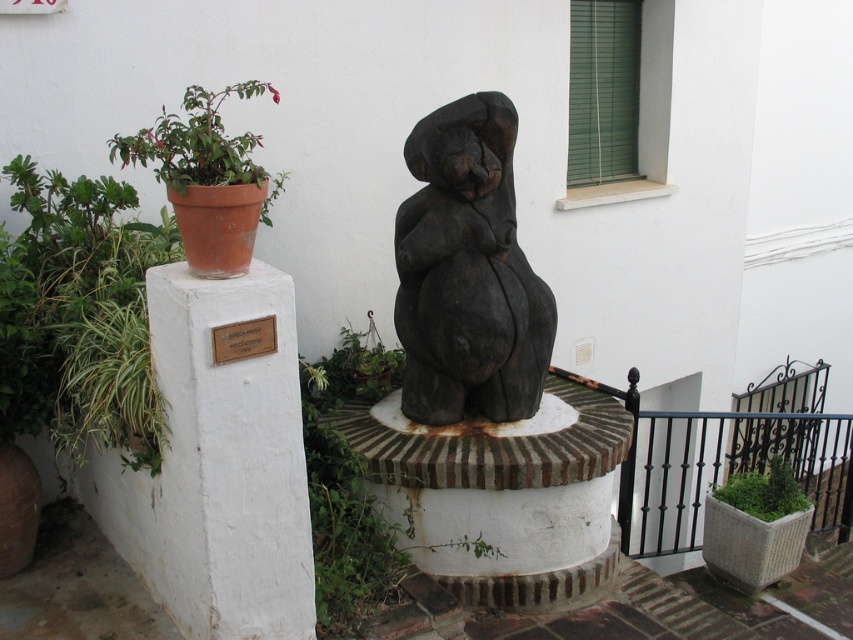
You are a gardener who needs to water the green leafy plant at left and the black wood statue at center. Which one requires more water based on their sizes?

The green leafy plant at left requires more water because it has a larger size compared to the black wood statue at center.

Based on the photo, you are a gardener who needs to water the green mossy planter at lower right. You have a watering can that can spray water up to 6 feet. If you stand next to the black wood statue at center, can you reach the planter with the watering can?

The distance between the black wood statue at center and the green mossy planter at lower right is 5.92 feet, which is within the 6 feet range of the watering can. Therefore, you can reach the planter while standing next to the black wood statue at center.

You are a gardener who needs to move the green leafy plant at left to a wider pot. The white concrete pillar at left is currently blocking your path. Can you move the pillar first to access the plant?

The white concrete pillar at left is thinner than the green leafy plant at left, so it can be moved aside to allow access to the plant.